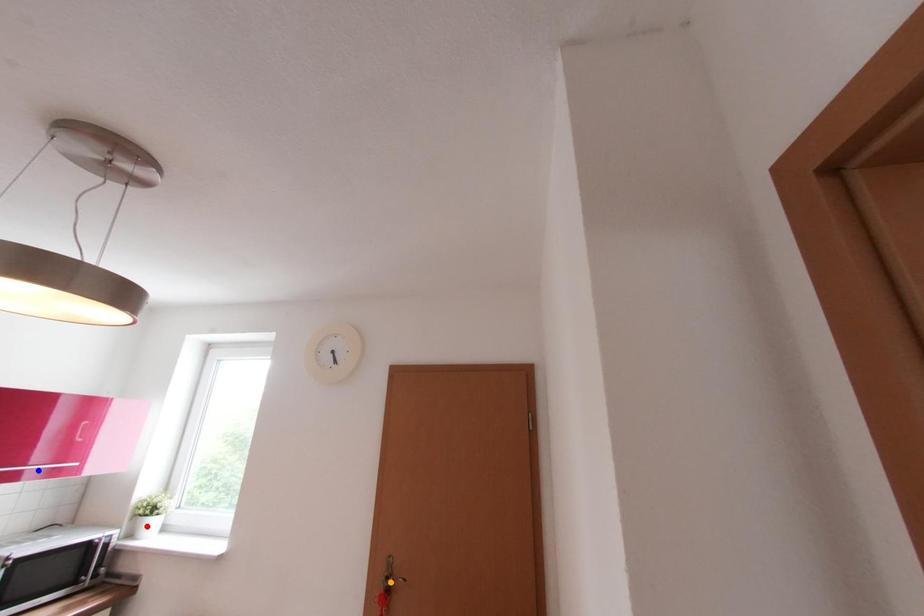
Order these from nearest to farthest:
1. orange point
2. blue point
3. red point

red point, orange point, blue point